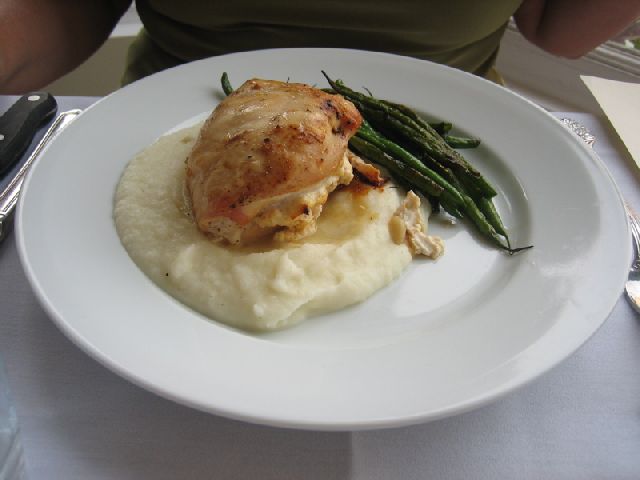
I want to click on table cloth, so click(x=564, y=427).